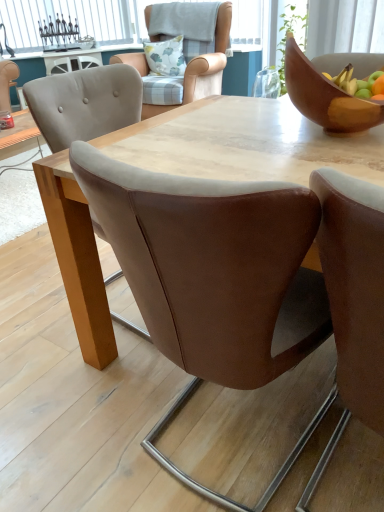
The image size is (384, 512). What do you see at coordinates (66, 20) in the screenshot?
I see `white glass window at upper left` at bounding box center [66, 20].

What is the approximate width of fluffy cotton pillow at upper center?

The width of fluffy cotton pillow at upper center is 5.76 inches.

I want to click on white glass window at upper left, so click(66, 20).

Do you think light brown leather chair at upper center, the 1th chair positioned from the back, is within wooden bowl at upper right, or outside of it?

light brown leather chair at upper center, the 1th chair positioned from the back, is outside wooden bowl at upper right.

From a real-world perspective, is light brown leather chair at upper center, the 1th chair positioned from the back, on wooden bowl at upper right?

No, from a real-world perspective, light brown leather chair at upper center, the 1th chair positioned from the back, is not above wooden bowl at upper right.

Is light brown leather chair at upper center, the 1th chair positioned from the back, oriented away from wooden bowl at upper right?

That's not correct — light brown leather chair at upper center, the 1th chair positioned from the back, is not looking away from wooden bowl at upper right.

Can you tell me how much light brown leather chair at upper center, the 1th chair positioned from the back, and wooden bowl at upper right differ in facing direction?

They differ by 1.65 degrees in their facing directions.

From a real-world perspective, is brown leather chair at center, which is counted as the third chair, starting from the back, below light brown leather chair at upper center, the 1th chair positioned from the back?

Yes, from a real-world perspective, brown leather chair at center, which is counted as the third chair, starting from the back, is beneath light brown leather chair at upper center, the 1th chair positioned from the back.

Is brown leather chair at center, which is counted as the third chair, starting from the back, positioned with its back to light brown leather chair at upper center, which is counted as the fourth chair, starting from the front?

No, brown leather chair at center, which is counted as the third chair, starting from the back, is not facing the opposite direction of light brown leather chair at upper center, which is counted as the fourth chair, starting from the front.

Is brown leather chair at center, which is counted as the third chair, starting from the back, to the left or to the right of light brown leather chair at upper center, the 1th chair positioned from the back, in the image?

brown leather chair at center, which is counted as the third chair, starting from the back, is positioned on light brown leather chair at upper center, the 1th chair positioned from the back,'s left side.

Considering the relative positions of brown leather chair at center, which ranks as the 2th chair in front-to-back order, and light brown leather chair at upper center, the 1th chair positioned from the back, in the image provided, is brown leather chair at center, which ranks as the 2th chair in front-to-back order, in front of light brown leather chair at upper center, the 1th chair positioned from the back,?

Yes, it is.

Consider the image. Is brown leather chair at center, the 4th chair in the back-to-front sequence, positioned with its back to light brown leather chair at upper center, the 1th chair positioned from the back?

No.

From the image's perspective, relative to light brown leather chair at upper center, which is counted as the fourth chair, starting from the front, is brown leather chair at center, positioned as the first chair in front-to-back order, above or below?

brown leather chair at center, positioned as the first chair in front-to-back order, is situated lower than light brown leather chair at upper center, which is counted as the fourth chair, starting from the front, in the image.

Does point (382, 373) come closer to viewer compared to point (143, 79)?

Yes.

Would you say brown leather chair at center, the 4th chair in the back-to-front sequence, is outside light brown leather chair at upper center, which is counted as the fourth chair, starting from the front?

Indeed, brown leather chair at center, the 4th chair in the back-to-front sequence, is completely outside light brown leather chair at upper center, which is counted as the fourth chair, starting from the front.

Considering the relative positions of brown leather chair at center, the 4th chair in the back-to-front sequence, and brown leather chair at center, which is the third chair in front-to-back order, in the image provided, is brown leather chair at center, the 4th chair in the back-to-front sequence, behind brown leather chair at center, which is the third chair in front-to-back order,?

No, it is not.

Considering the relative sizes of brown leather chair at center, positioned as the first chair in front-to-back order, and brown leather chair at center, which is the third chair in front-to-back order, in the image provided, is brown leather chair at center, positioned as the first chair in front-to-back order, smaller than brown leather chair at center, which is the third chair in front-to-back order,?

Yes, brown leather chair at center, positioned as the first chair in front-to-back order, is smaller than brown leather chair at center, which is the third chair in front-to-back order.

Is brown leather chair at center, the 4th chair in the back-to-front sequence, thinner than brown leather chair at center, which is the third chair in front-to-back order?

No.

Consider the image. Is brown leather chair at center, the 4th chair in the back-to-front sequence, to the left of brown leather chair at center, which is the third chair in front-to-back order, from the viewer's perspective?

Incorrect, brown leather chair at center, the 4th chair in the back-to-front sequence, is not on the left side of brown leather chair at center, which is the third chair in front-to-back order.

Between brown leather chair at center, which ranks as the 2th chair in front-to-back order, and wooden bowl at upper right, which one has smaller width?

Thinner between the two is wooden bowl at upper right.

Is brown leather chair at center, which is counted as the third chair, starting from the back, in front of wooden bowl at upper right?

Yes, brown leather chair at center, which is counted as the third chair, starting from the back, is in front of wooden bowl at upper right.

Do you think brown leather chair at center, which is counted as the third chair, starting from the back, is within wooden bowl at upper right, or outside of it?

brown leather chair at center, which is counted as the third chair, starting from the back, is outside wooden bowl at upper right.

Looking at this image, which is nearer, (177, 473) or (325, 90)?

The point (325, 90) is closer.

From a real-world perspective, is light brown leather chair at upper center, the 1th chair positioned from the back, physically above brown leather chair at center, which is the third chair in front-to-back order?

Indeed, from a real-world perspective, light brown leather chair at upper center, the 1th chair positioned from the back, stands above brown leather chair at center, which is the third chair in front-to-back order.

Between light brown leather chair at upper center, the 1th chair positioned from the back, and brown leather chair at center, which is the third chair in front-to-back order, which one has less height?

With less height is brown leather chair at center, which is the third chair in front-to-back order.

Who is taller, wooden bowl at upper right or brown leather chair at center, which ranks as the 2th chair in front-to-back order?

Standing taller between the two is wooden bowl at upper right.

How much distance is there between wooden bowl at upper right and brown leather chair at center, which is counted as the third chair, starting from the back?

wooden bowl at upper right and brown leather chair at center, which is counted as the third chair, starting from the back, are 22.74 inches apart.

Considering the sizes of objects wooden bowl at upper right and brown leather chair at center, which is counted as the third chair, starting from the back, in the image provided, who is wider, wooden bowl at upper right or brown leather chair at center, which is counted as the third chair, starting from the back,?

Wider between the two is brown leather chair at center, which is counted as the third chair, starting from the back.

Based on their sizes in the image, would you say wooden bowl at upper right is bigger or smaller than brown leather chair at center, which is counted as the third chair, starting from the back?

Clearly, wooden bowl at upper right is smaller in size than brown leather chair at center, which is counted as the third chair, starting from the back.

There is a wooden bowl at upper right. Identify the location of the 1st chair below it (from a real-world perspective). (184, 53).

Locate an element on the screen. This screenshot has width=384, height=512. the 2nd chair to the left when counting from the light brown leather chair at upper center, which is counted as the fourth chair, starting from the front is located at coordinates click(x=215, y=279).

Considering their positions, is brown leather chair at center, the 4th chair in the back-to-front sequence, positioned further to brown leather chair at center, which is the third chair in front-to-back order, than wooden bowl at upper right?

Based on the image, brown leather chair at center, the 4th chair in the back-to-front sequence, appears to be further to brown leather chair at center, which is the third chair in front-to-back order.

Estimate the real-world distances between objects in this image. Which object is further from white glass window at upper left, light brown leather chair at upper center, the 1th chair positioned from the back, or fluffy cotton pillow at upper center?

Among the two, fluffy cotton pillow at upper center is located further to white glass window at upper left.

Considering their positions, is brown leather chair at center, which is the third chair in front-to-back order, positioned closer to brown leather chair at center, the 4th chair in the back-to-front sequence, than white glass window at upper left?

brown leather chair at center, which is the third chair in front-to-back order.

Which object lies nearer to the anchor point brown leather chair at center, the 4th chair in the back-to-front sequence, brown leather chair at center, which is the third chair in front-to-back order, or wooden bowl at upper right?

wooden bowl at upper right.

Based on their spatial positions, is brown leather chair at center, arranged as the second chair when viewed from the back, or light brown leather chair at upper center, the 1th chair positioned from the back, further from brown leather chair at center, which is counted as the third chair, starting from the back?

light brown leather chair at upper center, the 1th chair positioned from the back.

Which object lies further to the anchor point wooden bowl at upper right, brown leather chair at center, which is the third chair in front-to-back order, or fluffy cotton pillow at upper center?

fluffy cotton pillow at upper center is further to wooden bowl at upper right.

Based on their spatial positions, is fluffy cotton pillow at upper center or brown leather chair at center, arranged as the second chair when viewed from the back, further from brown leather chair at center, positioned as the first chair in front-to-back order?

The object further to brown leather chair at center, positioned as the first chair in front-to-back order, is fluffy cotton pillow at upper center.

Considering their positions, is white glass window at upper left positioned further to brown leather chair at center, the 4th chair in the back-to-front sequence, than brown leather chair at center, which is the third chair in front-to-back order?

Among the two, white glass window at upper left is located further to brown leather chair at center, the 4th chair in the back-to-front sequence.

The image size is (384, 512). Identify the location of bowl between brown leather chair at center, the 4th chair in the back-to-front sequence, and light brown leather chair at upper center, which is counted as the fourth chair, starting from the front, in the front-back direction. (331, 90).

Identify the location of pillow between brown leather chair at center, positioned as the first chair in front-to-back order, and white glass window at upper left from front to back. The image size is (384, 512). (166, 57).

The height and width of the screenshot is (512, 384). Find the location of `bowl between brown leather chair at center, positioned as the first chair in front-to-back order, and fluffy cotton pillow at upper center from front to back`. bowl between brown leather chair at center, positioned as the first chair in front-to-back order, and fluffy cotton pillow at upper center from front to back is located at coordinates (331, 90).

Where is `bowl located between brown leather chair at center, which ranks as the 2th chair in front-to-back order, and white glass window at upper left in the depth direction`? The height and width of the screenshot is (512, 384). bowl located between brown leather chair at center, which ranks as the 2th chair in front-to-back order, and white glass window at upper left in the depth direction is located at coordinates (331, 90).